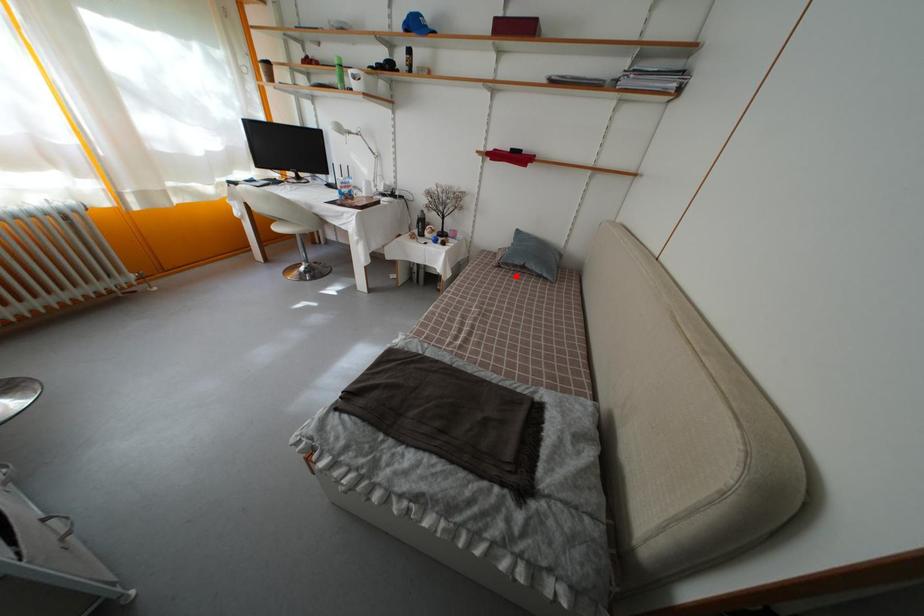
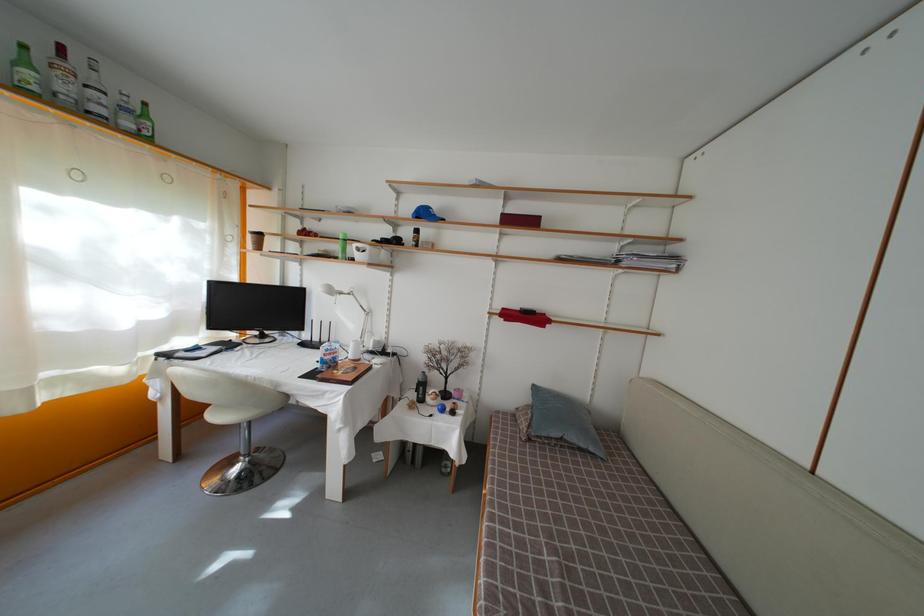
Question: I am providing you with two images of the same scene from different viewpoints. A red point is shown in image1. For the corresponding object point in image2, is it positioned nearer or farther from the camera?

Choices:
 (A) Nearer
 (B) Farther

Answer: (B)